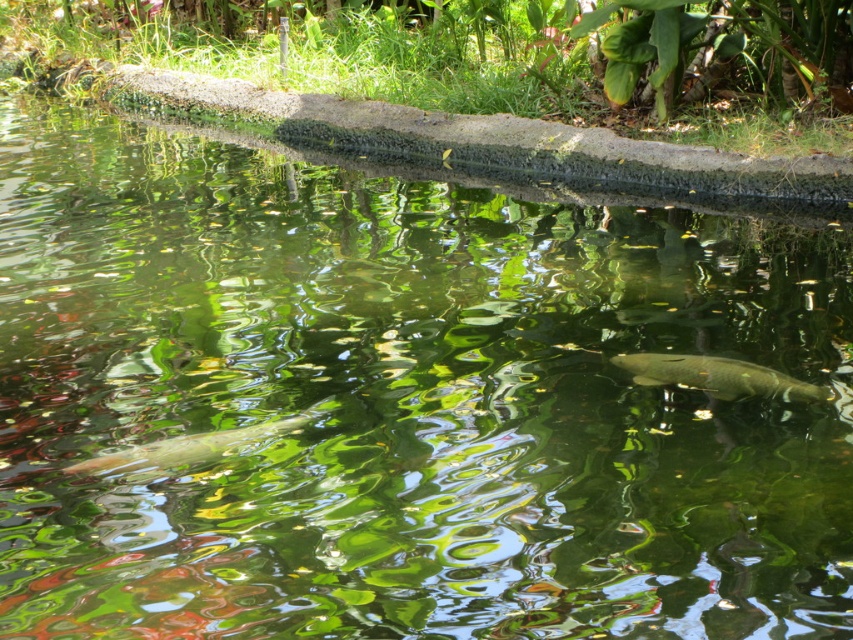
You are an underwater photographer aiming to capture both the green matte fish at center and the shiny silver fish at lower left in a single shot. Since you can only focus on one fish at a time, which fish should you focus on to ensure the other appears in the background?

You should focus on the green matte fish at center because the shiny silver fish at lower left is behind it, making it naturally appear in the background.

You are an angler trying to catch the green matte fish at center and the shiny silver fish at lower left. Which fish would require a stronger fishing rod to catch?

The green matte fish at center is larger in size than the shiny silver fish at lower left, so it would require a stronger fishing rod to catch.